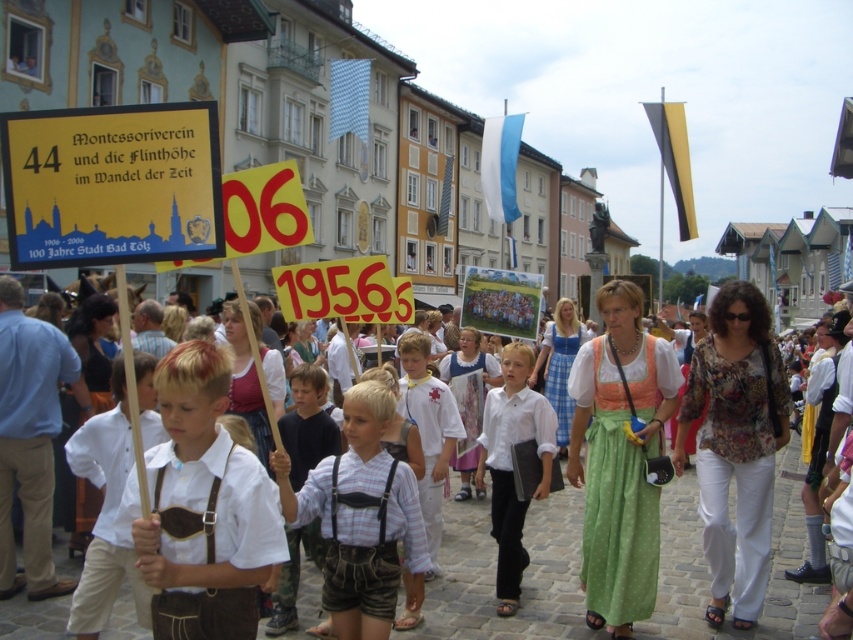
Does white striped shirt at center lie behind white cotton shirt at center?

No, it is in front of white cotton shirt at center.

Which is behind, point (392, 616) or point (479, 442)?

Positioned behind is point (479, 442).

Which is in front, point (335, 524) or point (515, 360)?

Point (335, 524) is more forward.

Image resolution: width=853 pixels, height=640 pixels. In order to click on white striped shirt at center in this screenshot , I will do `click(363, 518)`.

Is white leather suspenders at center to the left of white striped shirt at center from the viewer's perspective?

Correct, you'll find white leather suspenders at center to the left of white striped shirt at center.

Measure the distance between white leather suspenders at center and white striped shirt at center.

white leather suspenders at center is 4.06 meters away from white striped shirt at center.

Identify the location of white leather suspenders at center. The width and height of the screenshot is (853, 640). (202, 506).

Who is taller, white leather suspenders at center or white cotton shirt at center?

With more height is white cotton shirt at center.

Which is in front, point (154, 547) or point (549, 422)?

Point (154, 547) is more forward.

The width and height of the screenshot is (853, 640). Describe the element at coordinates (202, 506) in the screenshot. I see `white leather suspenders at center` at that location.

Where is `white leather suspenders at center`? The image size is (853, 640). white leather suspenders at center is located at coordinates (202, 506).